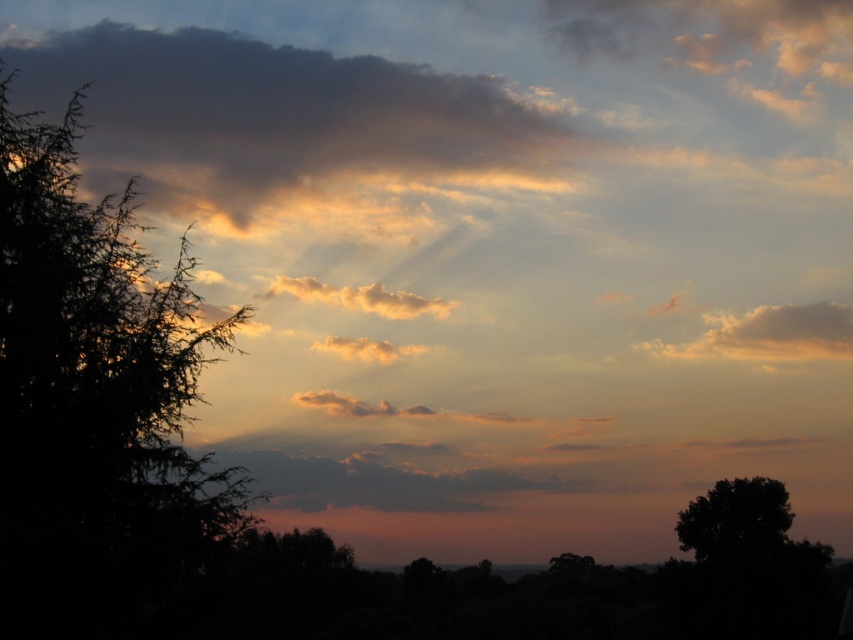
You are standing in the sunset scene and want to take a photo. There are two points in the scene marked as point 1 at coordinates point (x=15, y=572) and point 2 at coordinates point (x=548, y=563). Which point is closer to you?

Point (x=15, y=572) is closer to the camera than point (x=548, y=563), so point 1 is closer to you.

Based on the photo, you are an artist painting the sunset scene. You want to paint the dark gray cloud at upper left and the golden fluffy cloud at center. Which cloud should you paint first to ensure proper layering?

The dark gray cloud at upper left should be painted first because it is positioned over the golden fluffy cloud at center, meaning it needs to be layered on top.

You are an airplane pilot flying through the clouds. You see the dark gray cloud at upper left and the golden fluffy cloud at center. Which cloud is closer to your current position?

The dark gray cloud at upper left is closer to your current position because the golden fluffy cloud at center is behind it.